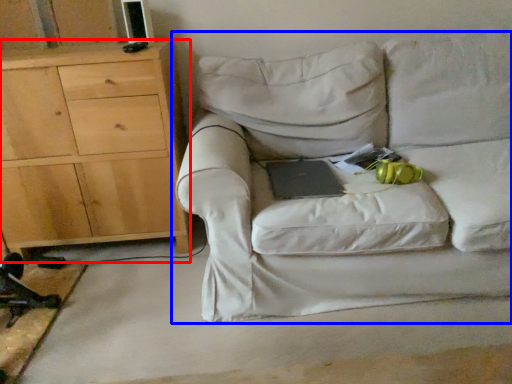
Question: Which point is closer to the camera, chest of drawers (highlighted by a red box) or studio couch (highlighted by a blue box)?

Choices:
 (A) chest of drawers
 (B) studio couch

Answer: (B)